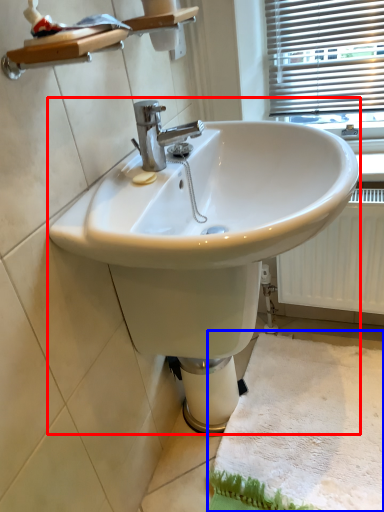
Question: Which object appears farthest to the camera in this image, sink (highlighted by a red box) or bath mat (highlighted by a blue box)?

Choices:
 (A) sink
 (B) bath mat

Answer: (B)